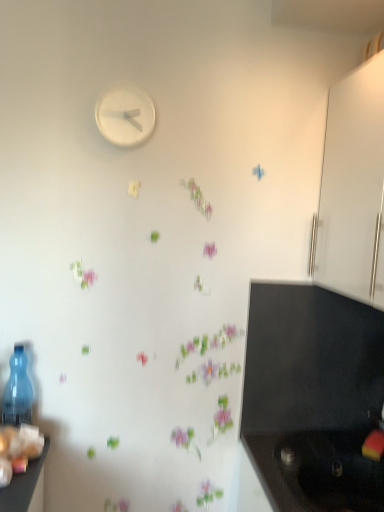
Question: Is black matte sink at lower right inside transparent plastic bottle at left?

Choices:
 (A) yes
 (B) no

Answer: (B)

Question: Considering the relative positions of transparent plastic bottle at left and black matte sink at lower right in the image provided, is transparent plastic bottle at left to the right of black matte sink at lower right from the viewer's perspective?

Choices:
 (A) yes
 (B) no

Answer: (B)

Question: From a real-world perspective, is transparent plastic bottle at left located higher than black matte sink at lower right?

Choices:
 (A) no
 (B) yes

Answer: (B)

Question: Is transparent plastic bottle at left smaller than black matte sink at lower right?

Choices:
 (A) no
 (B) yes

Answer: (B)

Question: Considering the relative positions of transparent plastic bottle at left and black matte sink at lower right in the image provided, is transparent plastic bottle at left to the left of black matte sink at lower right from the viewer's perspective?

Choices:
 (A) no
 (B) yes

Answer: (B)

Question: In the image, is white matte clock at upper center on the left side or the right side of transparent plastic bottle at left?

Choices:
 (A) right
 (B) left

Answer: (A)

Question: Considering the positions of point (107, 122) and point (29, 410), is point (107, 122) closer or farther from the camera than point (29, 410)?

Choices:
 (A) closer
 (B) farther

Answer: (A)

Question: Considering their positions, is white matte clock at upper center located in front of or behind transparent plastic bottle at left?

Choices:
 (A) behind
 (B) front

Answer: (A)

Question: Is white matte clock at upper center taller or shorter than transparent plastic bottle at left?

Choices:
 (A) short
 (B) tall

Answer: (A)

Question: From the image's perspective, is transparent plastic bottle at left positioned above or below white glossy cabinet at right?

Choices:
 (A) below
 (B) above

Answer: (A)

Question: Does point (18, 360) appear closer or farther from the camera than point (362, 146)?

Choices:
 (A) closer
 (B) farther

Answer: (B)

Question: Based on their sizes in the image, would you say transparent plastic bottle at left is bigger or smaller than white glossy cabinet at right?

Choices:
 (A) small
 (B) big

Answer: (A)

Question: Considering the positions of transparent plastic bottle at left and white glossy cabinet at right in the image, is transparent plastic bottle at left wider or thinner than white glossy cabinet at right?

Choices:
 (A) thin
 (B) wide

Answer: (A)

Question: Visually, is white matte clock at upper center positioned to the left or to the right of black matte sink at lower right?

Choices:
 (A) right
 (B) left

Answer: (B)

Question: Considering the positions of white matte clock at upper center and black matte sink at lower right in the image, is white matte clock at upper center taller or shorter than black matte sink at lower right?

Choices:
 (A) tall
 (B) short

Answer: (A)